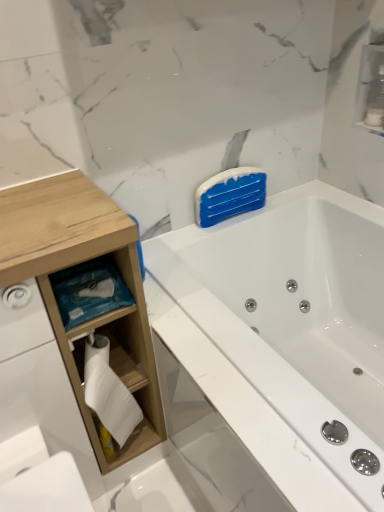
Question: Is wooden cabinet at left oriented towards white glossy bathtub at upper right?

Choices:
 (A) yes
 (B) no

Answer: (B)

Question: Does wooden cabinet at left have a smaller size compared to white glossy bathtub at upper right?

Choices:
 (A) no
 (B) yes

Answer: (B)

Question: Considering the relative sizes of wooden cabinet at left and white glossy bathtub at upper right in the image provided, is wooden cabinet at left taller than white glossy bathtub at upper right?

Choices:
 (A) yes
 (B) no

Answer: (A)

Question: From a real-world perspective, is wooden cabinet at left located beneath white glossy bathtub at upper right?

Choices:
 (A) no
 (B) yes

Answer: (A)

Question: Is wooden cabinet at left bigger than white glossy bathtub at upper right?

Choices:
 (A) no
 (B) yes

Answer: (A)

Question: Do you think white wood toilet paper holder at left, the 2th cabinet from the right, is within white glossy cabinet at upper right, which is counted as the first cabinet, starting from the top, or outside of it?

Choices:
 (A) inside
 (B) outside

Answer: (B)

Question: In terms of size, does white wood toilet paper holder at left, the 2th cabinet in the top-to-bottom sequence, appear bigger or smaller than white glossy cabinet at upper right, which is the 1th cabinet from right to left?

Choices:
 (A) big
 (B) small

Answer: (A)

Question: From the image's perspective, relative to white glossy cabinet at upper right, which is the second cabinet in left-to-right order, is white wood toilet paper holder at left, the 1th cabinet in the bottom-to-top sequence, above or below?

Choices:
 (A) above
 (B) below

Answer: (B)

Question: Looking at their shapes, would you say white wood toilet paper holder at left, arranged as the first cabinet when viewed from the left, is wider or thinner than white glossy cabinet at upper right, which is counted as the first cabinet, starting from the top?

Choices:
 (A) thin
 (B) wide

Answer: (B)

Question: Is point (57, 194) positioned closer to the camera than point (218, 316)?

Choices:
 (A) farther
 (B) closer

Answer: (B)

Question: Would you say wooden cabinet at left is to the left or to the right of white glossy bathtub at upper right in the picture?

Choices:
 (A) right
 (B) left

Answer: (B)

Question: Is wooden cabinet at left inside or outside of white glossy bathtub at upper right?

Choices:
 (A) inside
 (B) outside

Answer: (B)

Question: In terms of height, does wooden cabinet at left look taller or shorter compared to white glossy bathtub at upper right?

Choices:
 (A) short
 (B) tall

Answer: (B)

Question: Considering the relative positions of white wood toilet paper holder at left, arranged as the first cabinet when viewed from the left, and wooden cabinet at left in the image provided, is white wood toilet paper holder at left, arranged as the first cabinet when viewed from the left, to the left or to the right of wooden cabinet at left?

Choices:
 (A) left
 (B) right

Answer: (B)

Question: Is point (100, 316) positioned closer to the camera than point (1, 209)?

Choices:
 (A) closer
 (B) farther

Answer: (B)